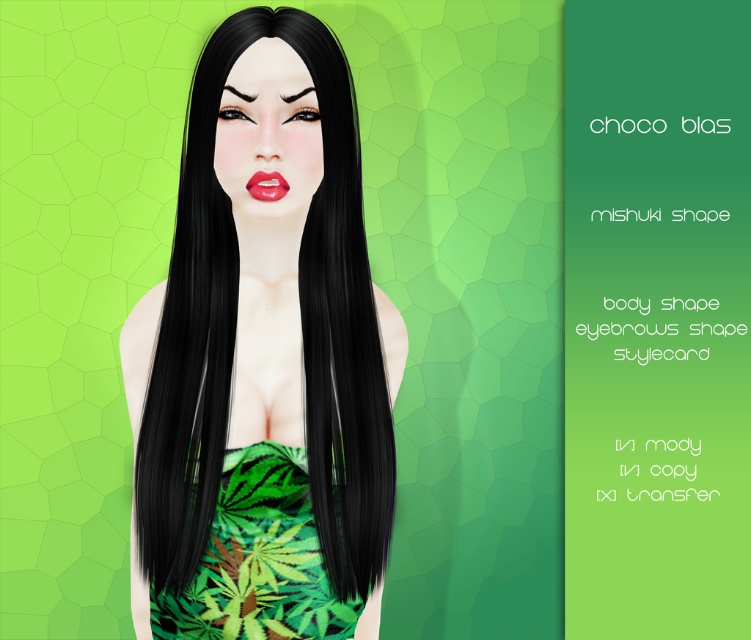
Is shiny black hair at center bigger than matte red lips at center?

Yes, shiny black hair at center is bigger than matte red lips at center.

Which is in front, point (210, 417) or point (264, 179)?

Point (264, 179) is more forward.

Does point (279, 250) lie in front of point (261, 200)?

That is False.

Locate an element on the screen. This screenshot has height=640, width=751. shiny black hair at center is located at coordinates (267, 316).

Can you confirm if green leafy fabric dress at center is shorter than matte red lips at center?

No, green leafy fabric dress at center is not shorter than matte red lips at center.

Which is in front, point (296, 497) or point (261, 176)?

Point (261, 176) is more forward.

Identify the location of green leafy fabric dress at center. This screenshot has height=640, width=751. (258, 561).

Who is shorter, shiny black hair at center or green leafy fabric dress at center?

green leafy fabric dress at center is shorter.

The width and height of the screenshot is (751, 640). Describe the element at coordinates (267, 316) in the screenshot. I see `shiny black hair at center` at that location.

Which is in front, point (189, 506) or point (234, 452)?

Point (234, 452) is more forward.

Find the location of a particular element. shiny black hair at center is located at coordinates (x=267, y=316).